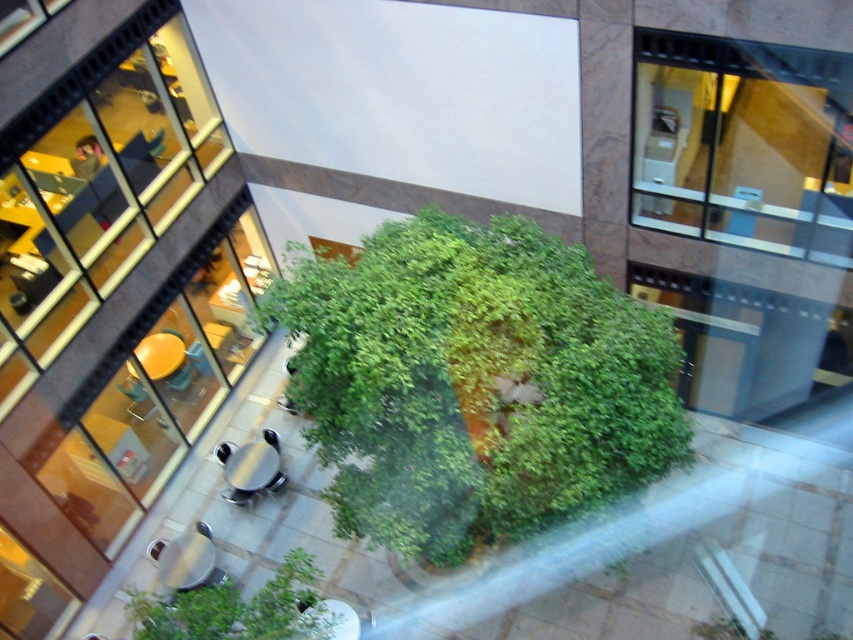
Question: Does green leafy bush at center appear on the right side of green leafy bush at lower center?

Choices:
 (A) yes
 (B) no

Answer: (A)

Question: Which point is closer to the camera?

Choices:
 (A) (648, 400)
 (B) (172, 614)

Answer: (B)

Question: Can you confirm if green leafy bush at center is bigger than green leafy bush at lower center?

Choices:
 (A) no
 (B) yes

Answer: (B)

Question: Is green leafy bush at center to the left of green leafy bush at lower center from the viewer's perspective?

Choices:
 (A) no
 (B) yes

Answer: (A)